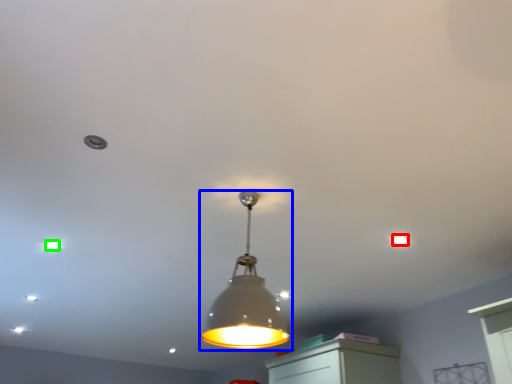
Question: Which is farther away from dot (highlighted by a red box)? lamp (highlighted by a blue box) or dot (highlighted by a green box)?

Choices:
 (A) lamp
 (B) dot

Answer: (B)